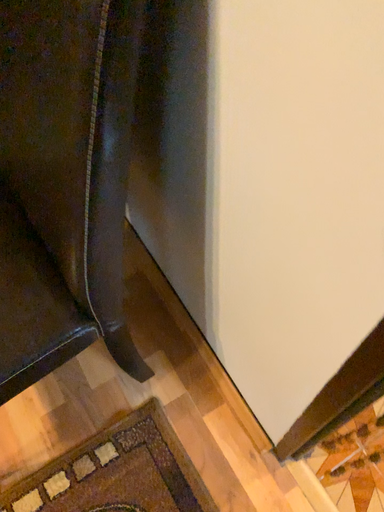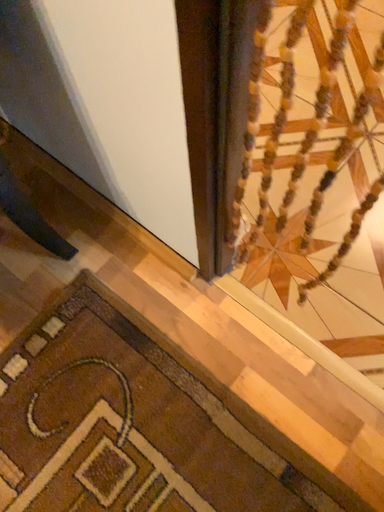
Question: How did the camera likely rotate when shooting the video?

Choices:
 (A) rotated downward
 (B) rotated upward

Answer: (A)